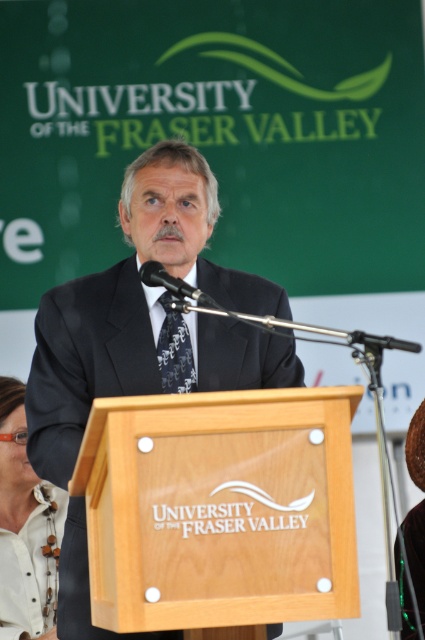
Can you confirm if dark suit at center is positioned to the right of patterned silk tie at center?

Incorrect, dark suit at center is not on the right side of patterned silk tie at center.

Which is more to the right, dark suit at center or patterned silk tie at center?

patterned silk tie at center

Where is `dark suit at center`? Image resolution: width=425 pixels, height=640 pixels. dark suit at center is located at coordinates (129, 305).

The width and height of the screenshot is (425, 640). What do you see at coordinates (25, 529) in the screenshot?
I see `white leather necklace at lower left` at bounding box center [25, 529].

Between point (14, 480) and point (170, 301), which one is positioned in front?

Point (170, 301) is in front.

Where is `white leather necklace at lower left`? The image size is (425, 640). white leather necklace at lower left is located at coordinates (25, 529).

Can you confirm if dark suit at center is positioned to the left of white leather necklace at lower left?

Incorrect, dark suit at center is not on the left side of white leather necklace at lower left.

Looking at this image, who is shorter, dark suit at center or white leather necklace at lower left?

Standing shorter between the two is white leather necklace at lower left.

Where is `dark suit at center`? The width and height of the screenshot is (425, 640). dark suit at center is located at coordinates (129, 305).